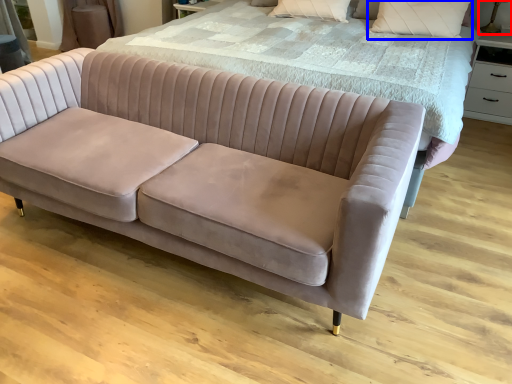
Question: Which object is closer to the camera taking this photo, table lamp (highlighted by a red box) or pillow (highlighted by a blue box)?

Choices:
 (A) table lamp
 (B) pillow

Answer: (B)